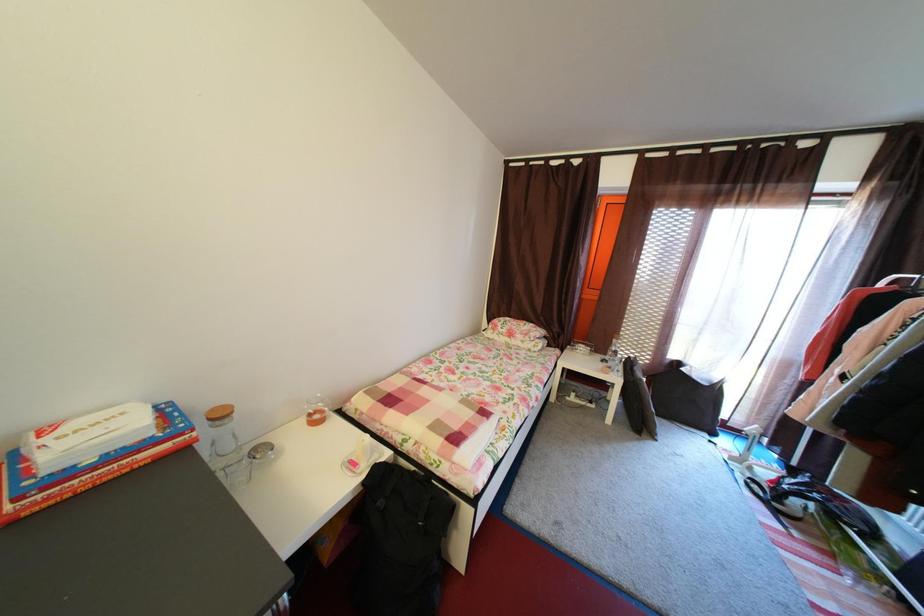
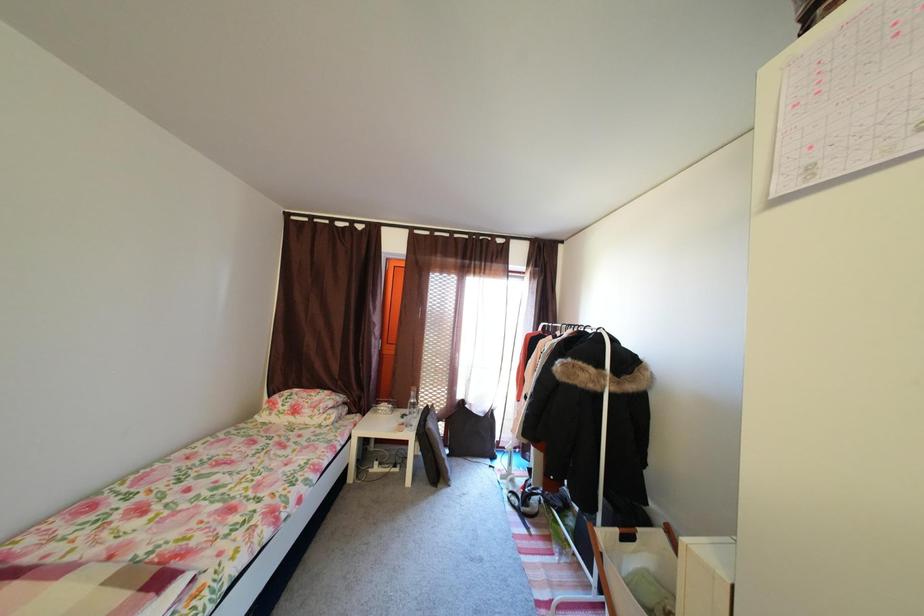
Question: The camera is either moving clockwise (left) or counter-clockwise (right) around the object. The first image is from the beginning of the video and the second image is from the end. Is the camera moving left or right when shooting the video?

Choices:
 (A) Left
 (B) Right

Answer: (A)